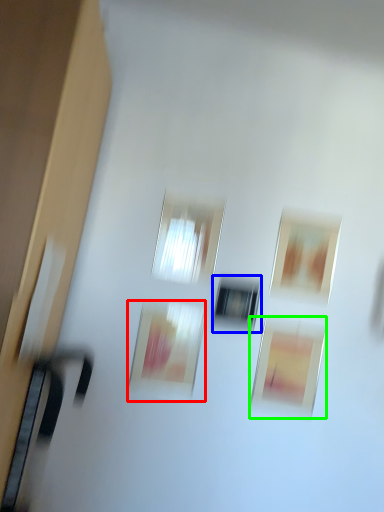
Question: Based on their relative distances, which object is farther from picture frame (highlighted by a red box)? Choose from window (highlighted by a blue box) and picture frame (highlighted by a green box).

Choices:
 (A) window
 (B) picture frame

Answer: (B)